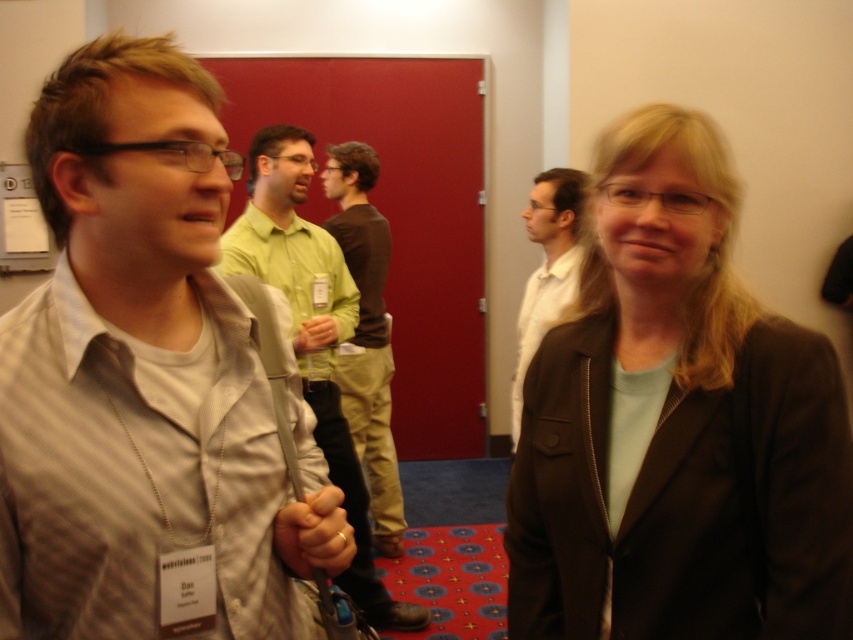
You are organizing a photo shoot and need to ensure that the matte black blazer at center and the white shirt at center are arranged in the correct spatial relationship as shown in the image. According to the scene description, which object should be placed to the right of the other?

The matte black blazer at center should be positioned on the right side of the white shirt at center, as stated in the Objects Description.

You are standing at the camera position and want to reach point (788, 476). The maximum distance you can walk is 30 inches. Can you reach it?

The point (788, 476) is 36.11 inches from the camera, which is beyond your maximum walking distance of 30 inches. You cannot reach it.